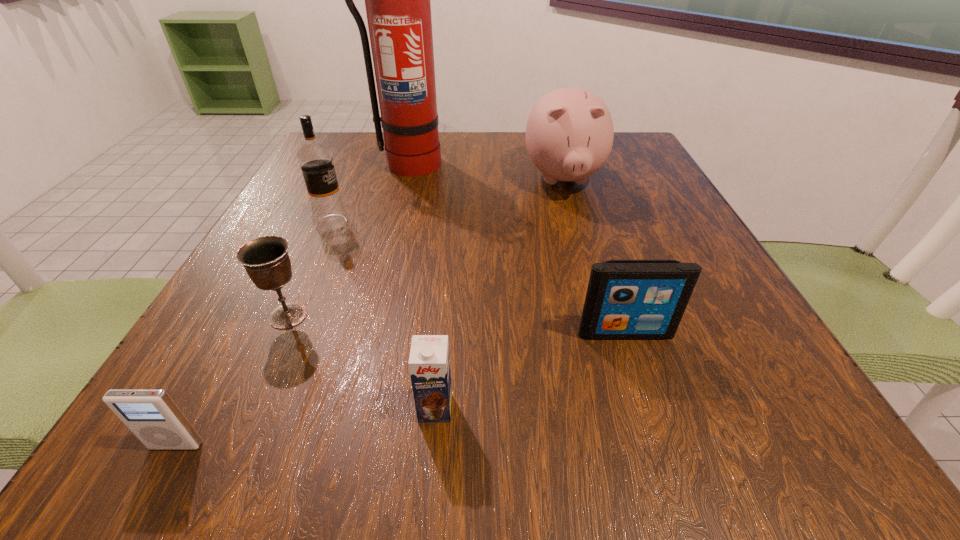
This screenshot has width=960, height=540. In the image, there is a desktop. Find the location of `vacant space at the right edge`. vacant space at the right edge is located at coordinates (707, 264).

What are the coordinates of `free point at the far right corner` in the screenshot? It's located at pos(622,167).

You are a GUI agent. You are given a task and a screenshot of the screen. Output one action in this format:
    pyautogui.click(x=<x>, y=<y>)
    Task: Click on the free point between the right iPod and the chalice
    This screenshot has width=960, height=540.
    Given the screenshot: What is the action you would take?
    coord(457,324)

Locate an element on the screen. vacant space that is in between the vodka and the piggy bank is located at coordinates (447, 201).

I want to click on blank region between the taller iPod and the second nearest object, so click(x=530, y=370).

Locate an element on the screen. vacant area between the farther iPod and the chalice is located at coordinates (457, 324).

The height and width of the screenshot is (540, 960). What are the coordinates of `free space between the taller iPod and the piggy bank` in the screenshot? It's located at (594, 256).

Image resolution: width=960 pixels, height=540 pixels. I want to click on empty location between the tallest object and the piggy bank, so click(x=485, y=172).

Locate an element on the screen. The image size is (960, 540). vacant area between the piggy bank and the fire extinguisher is located at coordinates (485, 172).

Locate an element on the screen. The image size is (960, 540). free space between the piggy bank and the chalice is located at coordinates (426, 248).